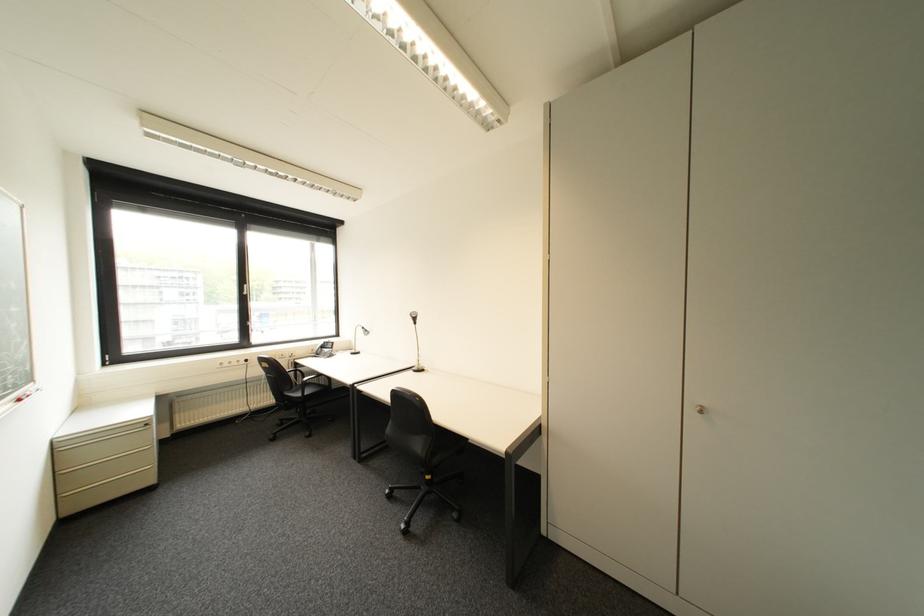
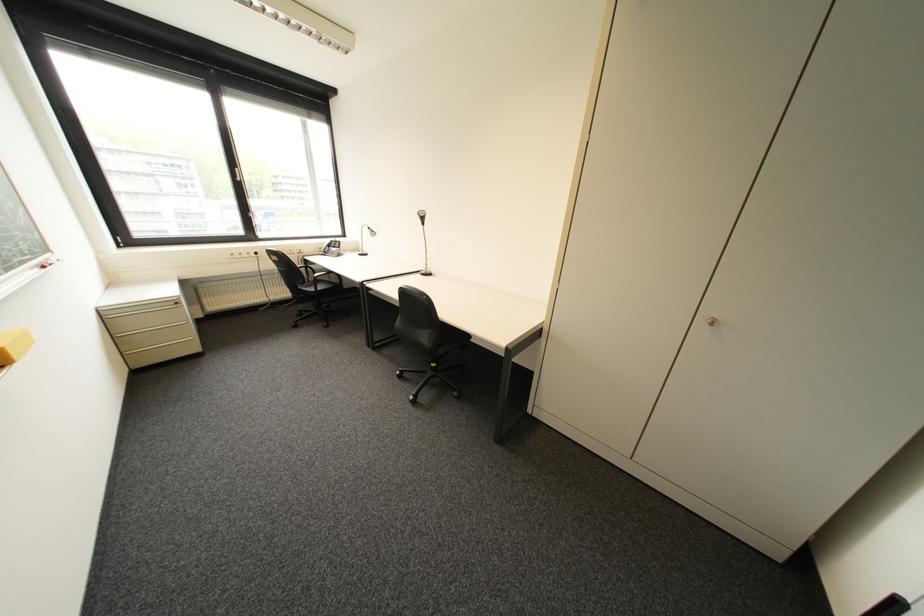
The point at (71, 450) is marked in the first image. Where is the corresponding point in the second image?

(119, 318)